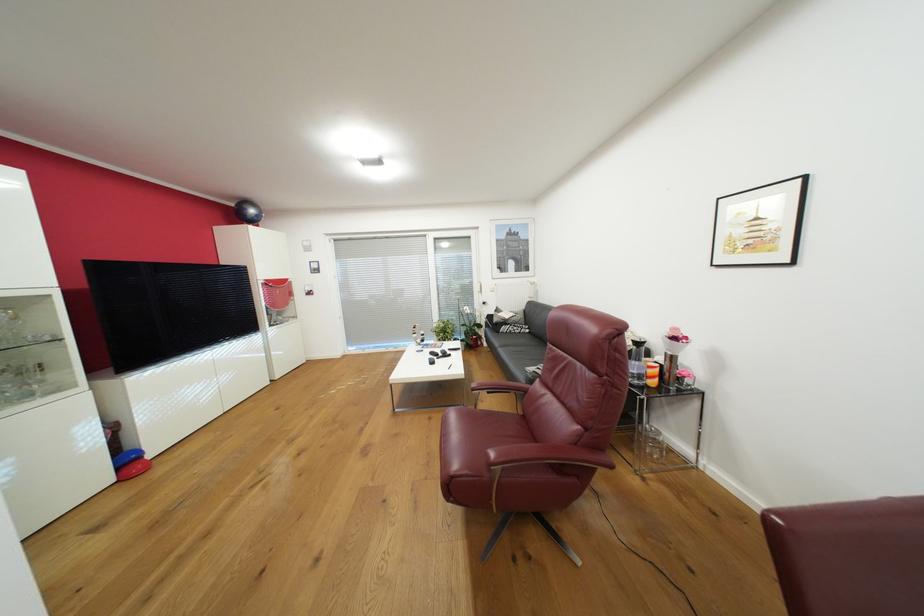
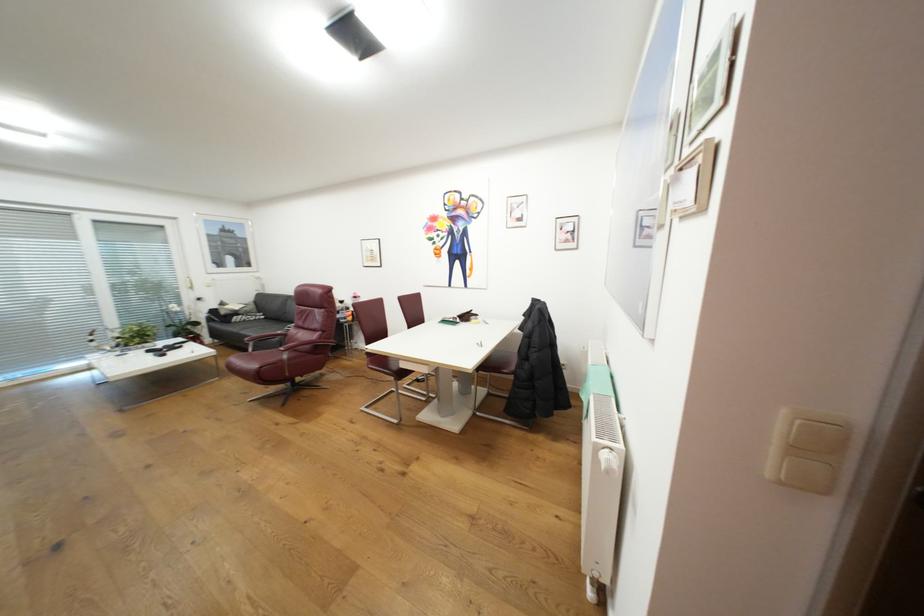
In the second image, find the point that corresponds to point (511, 328) in the first image.

(244, 318)